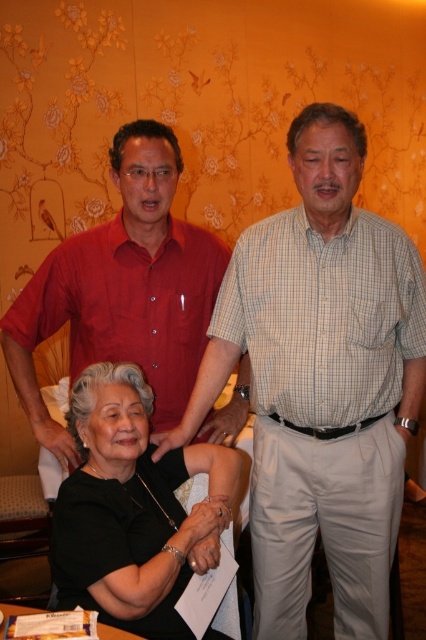
Based on the scene description, which object is larger between the matte red shirt at upper left and the black matte shirt at center?

The matte red shirt at upper left is bigger than the black matte shirt at center according to the description.

From the picture: You are a photographer setting up for a group photo. You need to ensure that the black matte shirt at center and the white paper at lower center are both visible in the frame. Based on their positions, which object should be placed closer to the camera to ensure both are in focus?

The white paper at lower center should be placed closer to the camera because the black matte shirt at center might be wider than the white paper at lower center, so adjusting their positions can help maintain focus on both.

You are a photographer trying to capture a detailed shot of both the black matte shirt at center and the white paper at lower center. Given that your camera has a depth of field that can focus on objects within a 12 inch range, will you be able to ensure both items are in focus without adjusting your camera settings?

The black matte shirt at center and white paper at lower center are 11.85 inches apart, which is within the 12 inch range of the camera depth of field. Therefore, both items can be kept in focus without adjusting the camera settings.